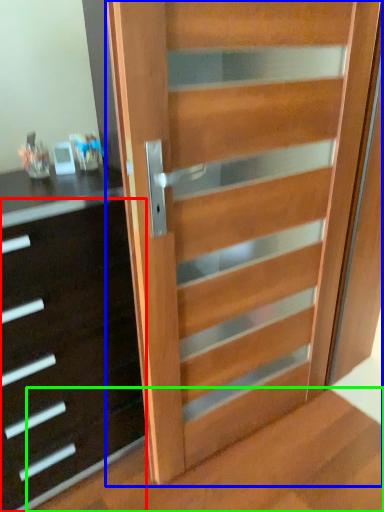
Question: Estimate the real-world distances between objects in this image. Which object is closer to chest of drawers (highlighted by a red box), door (highlighted by a blue box) or stairwell (highlighted by a green box)?

Choices:
 (A) door
 (B) stairwell

Answer: (A)